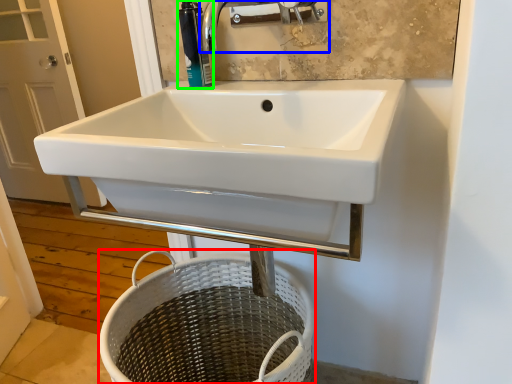
Question: Considering the real-world distances, which object is farthest from basket (highlighted by a red box)? tap (highlighted by a blue box) or soap dispenser (highlighted by a green box)?

Choices:
 (A) tap
 (B) soap dispenser

Answer: (A)